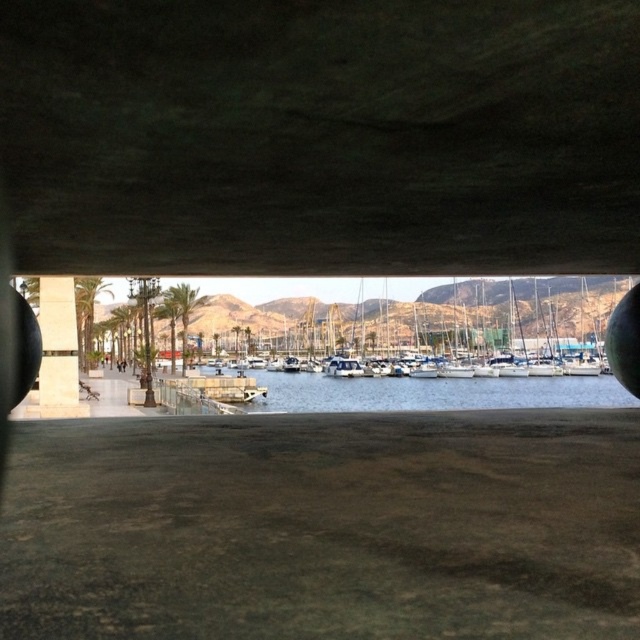
Can you confirm if white glossy boats at center is wider than beige concrete pillar at left?

Correct, the width of white glossy boats at center exceeds that of beige concrete pillar at left.

Consider the image. Measure the distance between white glossy boats at center and beige concrete pillar at left.

white glossy boats at center and beige concrete pillar at left are 48.93 meters apart from each other.

Locate an element on the screen. white glossy boats at center is located at coordinates tap(428, 317).

This screenshot has height=640, width=640. What are the coordinates of `white glossy boats at center` in the screenshot? It's located at 428,317.

Based on the photo, can you confirm if dark concrete overpass at upper center is positioned to the right of white glossy boats at center?

No, dark concrete overpass at upper center is not to the right of white glossy boats at center.

Is dark concrete overpass at upper center positioned behind white glossy boats at center?

No, dark concrete overpass at upper center is closer to the viewer.

Is point (529, 193) positioned before point (550, 336)?

Yes, it is in front of point (550, 336).

Locate an element on the screen. dark concrete overpass at upper center is located at coordinates (321, 134).

Looking at this image, is dark concrete overpass at upper center to the right of beige concrete pillar at left from the viewer's perspective?

Indeed, dark concrete overpass at upper center is positioned on the right side of beige concrete pillar at left.

Which is behind, point (424, 230) or point (65, 304)?

Point (65, 304)

Describe the element at coordinates (321, 134) in the screenshot. I see `dark concrete overpass at upper center` at that location.

The height and width of the screenshot is (640, 640). What are the coordinates of `dark concrete overpass at upper center` in the screenshot? It's located at (321, 134).